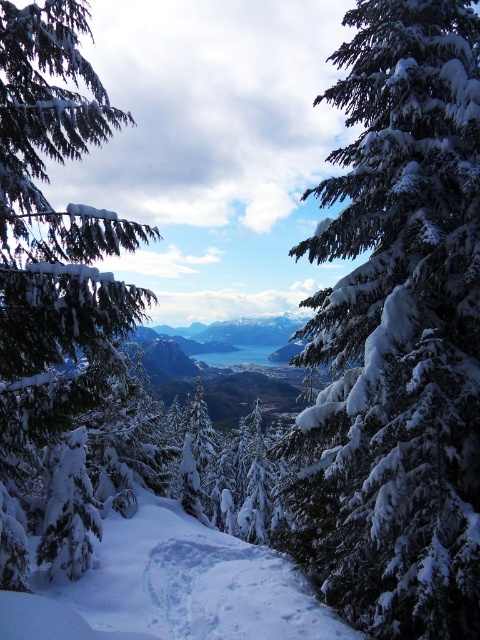
Is white snow-covered tree at left thinner than white fluffy snow at center?

No, white snow-covered tree at left is not thinner than white fluffy snow at center.

Image resolution: width=480 pixels, height=640 pixels. What do you see at coordinates (54, 285) in the screenshot?
I see `white snow-covered tree at left` at bounding box center [54, 285].

Measure the distance between point (2, 403) and camera.

The distance of point (2, 403) from camera is 6.78 meters.

The height and width of the screenshot is (640, 480). What are the coordinates of `white snow-covered tree at left` in the screenshot? It's located at (54, 285).

Who is positioned more to the left, snow-covered evergreen at center or white snow-covered tree at left?

white snow-covered tree at left

Can you confirm if snow-covered evergreen at center is smaller than white snow-covered tree at left?

Yes, snow-covered evergreen at center is smaller than white snow-covered tree at left.

Describe the element at coordinates (398, 332) in the screenshot. I see `snow-covered evergreen at center` at that location.

Locate an element on the screen. snow-covered evergreen at center is located at coordinates (398, 332).

Can you confirm if snow-covered evergreen at center is smaller than white fluffy snow at center?

Actually, snow-covered evergreen at center might be larger than white fluffy snow at center.

Can you confirm if snow-covered evergreen at center is positioned to the left of white fluffy snow at center?

In fact, snow-covered evergreen at center is to the right of white fluffy snow at center.

Locate an element on the screen. snow-covered evergreen at center is located at coordinates (398, 332).